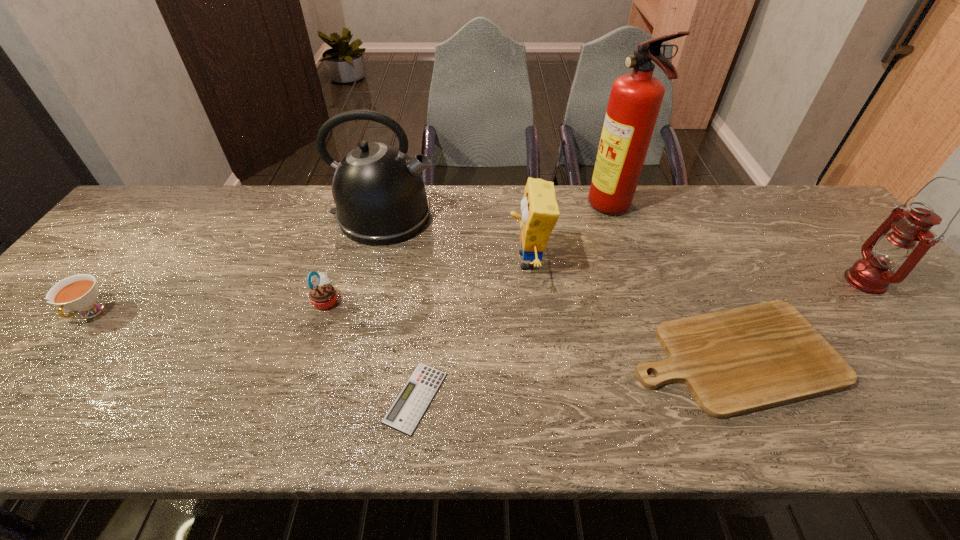
Locate an element on the screen. The width and height of the screenshot is (960, 540). the tallest object is located at coordinates (635, 99).

Locate an element on the screen. This screenshot has height=540, width=960. kettle is located at coordinates (379, 192).

Identify the location of the rightmost object. The height and width of the screenshot is (540, 960). (872, 274).

Locate an element on the screen. Image resolution: width=960 pixels, height=540 pixels. sponge is located at coordinates (539, 209).

This screenshot has width=960, height=540. I want to click on the fourth tallest object, so click(x=539, y=209).

Identify the location of the fifth tallest object. (322, 294).

Locate an element on the screen. The width and height of the screenshot is (960, 540). teacup is located at coordinates (79, 292).

You are a GUI agent. You are given a task and a screenshot of the screen. Output one action in this format:
    pyautogui.click(x=<x>, y=<y>)
    Task: Click on the sixth tallest object
    
    Given the screenshot: What is the action you would take?
    pyautogui.click(x=79, y=292)

Image resolution: width=960 pixels, height=540 pixels. I want to click on chopping board, so click(735, 361).

Find the location of a particular element. Image resolution: width=960 pixels, height=540 pixels. calculator is located at coordinates coord(405,413).